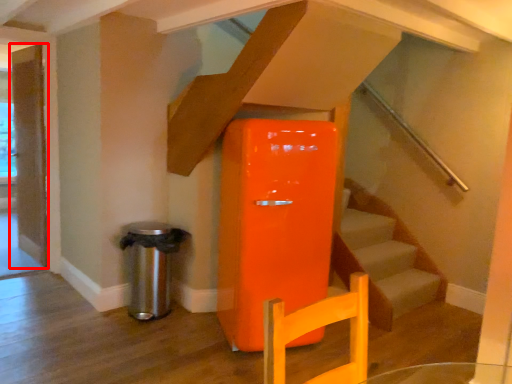
Question: Observing the image, what is the correct spatial positioning of door (annotated by the red box) in reference to water heater?

Choices:
 (A) left
 (B) right

Answer: (A)